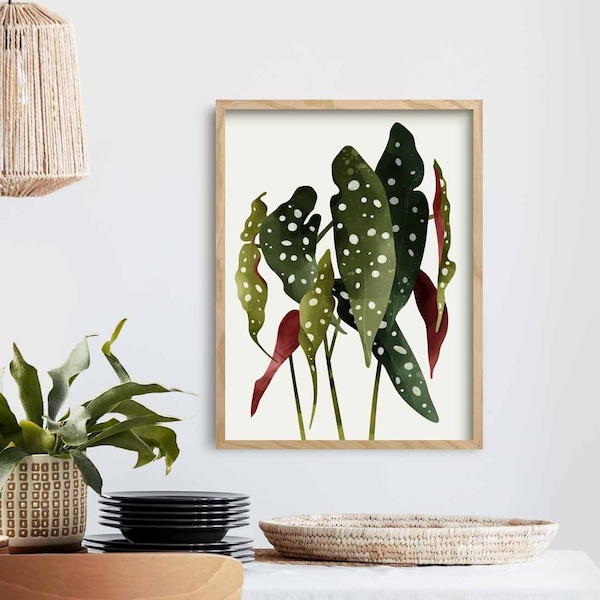
You are a GUI agent. You are given a task and a screenshot of the screen. Output one action in this format:
    pyautogui.click(x=<x>, y=<y>)
    Task: Click on the table
    This screenshot has height=600, width=600.
    Given the screenshot: What is the action you would take?
    pyautogui.click(x=434, y=592)